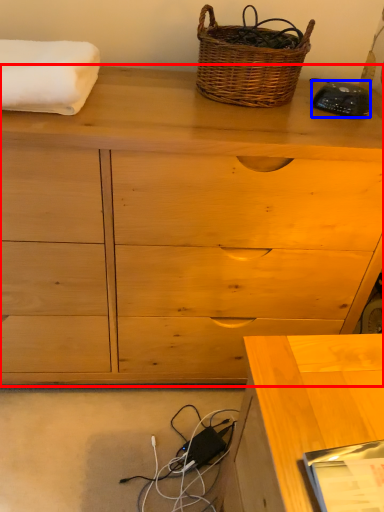
Question: Which object appears farthest to the camera in this image, chest of drawers (highlighted by a red box) or gadget (highlighted by a blue box)?

Choices:
 (A) chest of drawers
 (B) gadget

Answer: (B)